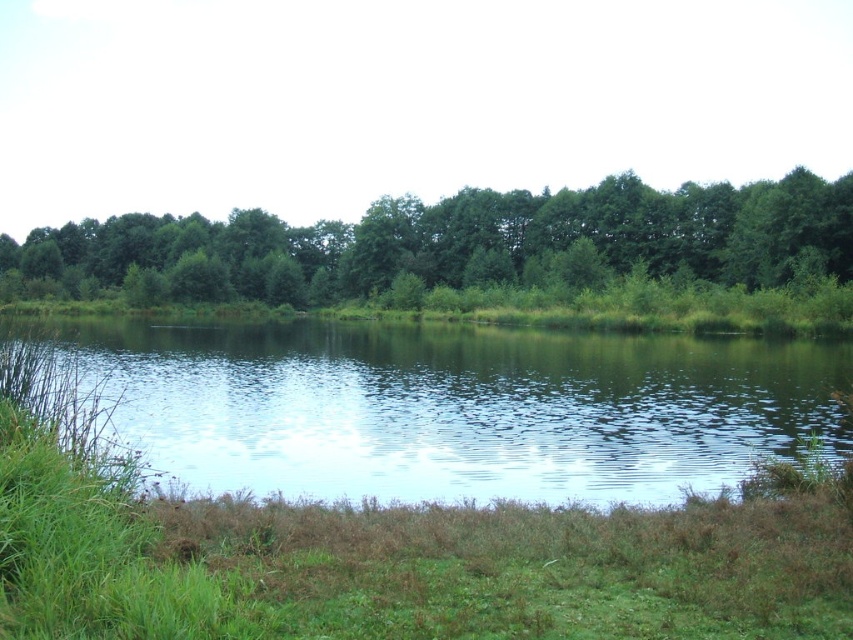
You are standing at the edge of the pond and see two points in the scene. The first point is at coordinates point (560, 404), and the second is at point (427, 596). Which point is closer to you?

Point (427, 596) is closer to you because it is in front of point (560, 404).

You are standing at the edge of the scene and want to walk towards the green reflective water at center. Which direction should you walk relative to the green leafy trees at center?

You should walk to the right relative to the green leafy trees at center because the green reflective water at center is positioned to the right of the green leafy trees at center.